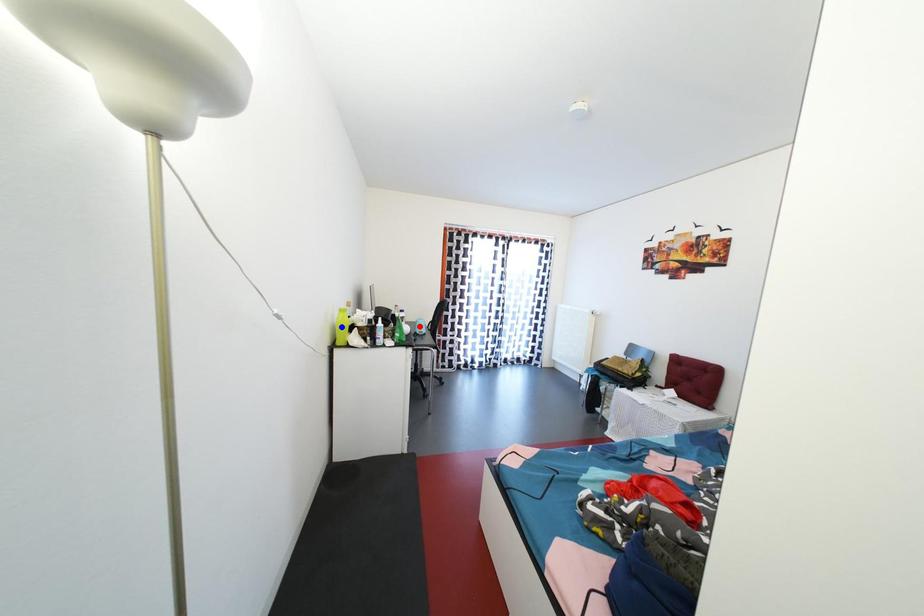
Question: Which of the two points in the image is closer to the camera?

Choices:
 (A) Blue point is closer.
 (B) Red point is closer.

Answer: (A)